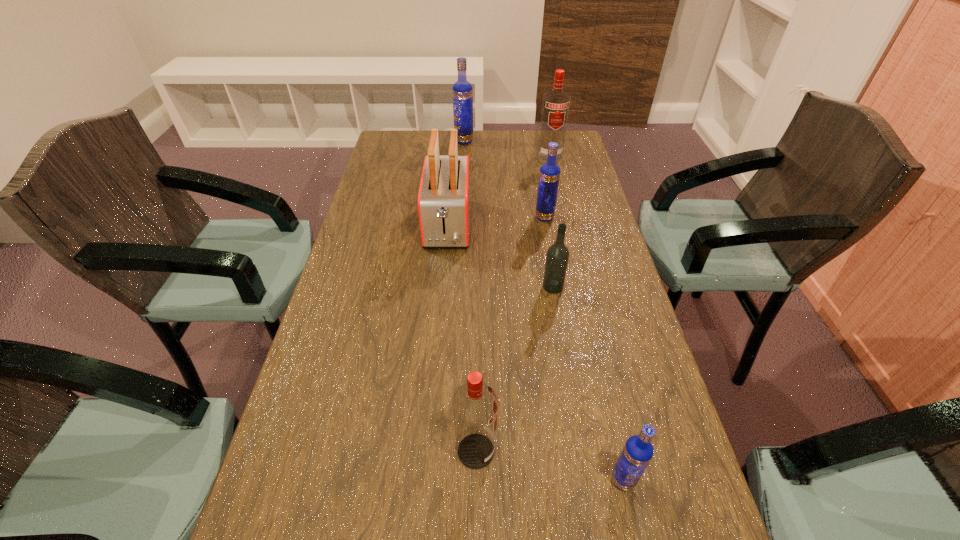
Locate an element on the screen. The height and width of the screenshot is (540, 960). object that is at the far right corner is located at coordinates (556, 103).

Where is `free space at the far edge of the desktop`? The width and height of the screenshot is (960, 540). free space at the far edge of the desktop is located at coordinates (486, 150).

At what (x,y) coordinates should I click in order to perform the action: click on vacant area at the left edge. Please return your answer as a coordinate pair (x, y). This screenshot has width=960, height=540. Looking at the image, I should click on pyautogui.click(x=377, y=163).

Find the location of a particular element. This screenshot has width=960, height=540. free space at the right edge of the desktop is located at coordinates (618, 301).

The width and height of the screenshot is (960, 540). In the image, there is a desktop. What are the coordinates of `vacant space at the far left corner` in the screenshot? It's located at (422, 139).

This screenshot has height=540, width=960. Find the location of `vacant space at the far right corner`. vacant space at the far right corner is located at coordinates (573, 161).

At what (x,y) coordinates should I click in order to perform the action: click on empty space between the rightmost blue vodka and the left red vodka. Please return your answer as a coordinate pair (x, y). Looking at the image, I should click on click(x=549, y=465).

Find the location of a particular element. Image resolution: width=960 pixels, height=540 pixels. vacant space in between the toaster and the sixth nearest object is located at coordinates (499, 191).

Image resolution: width=960 pixels, height=540 pixels. I want to click on vacant area that lies between the second blue vodka from right to left and the nearer red vodka, so click(510, 334).

Where is `vacant space that's between the red toaster and the third nearest vodka`? The image size is (960, 540). vacant space that's between the red toaster and the third nearest vodka is located at coordinates (500, 256).